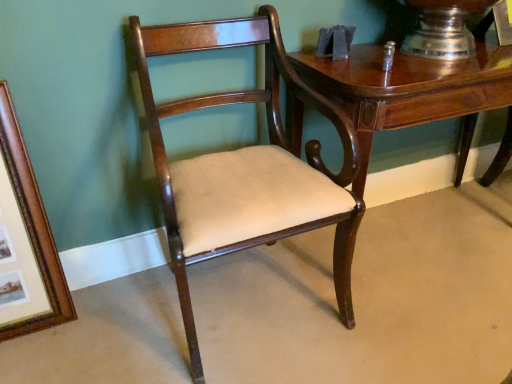
Question: From the image's perspective, is wooden picture frame at left located above mahogany wood chair at center?

Choices:
 (A) yes
 (B) no

Answer: (B)

Question: Can you confirm if wooden picture frame at left is bigger than mahogany wood chair at center?

Choices:
 (A) no
 (B) yes

Answer: (A)

Question: Does wooden picture frame at left lie behind mahogany wood chair at center?

Choices:
 (A) yes
 (B) no

Answer: (A)

Question: From the image's perspective, is wooden picture frame at left below mahogany wood chair at center?

Choices:
 (A) yes
 (B) no

Answer: (A)

Question: Can you confirm if wooden picture frame at left is wider than mahogany wood chair at center?

Choices:
 (A) no
 (B) yes

Answer: (A)

Question: Visually, is mahogany wood chair at center positioned to the left or to the right of glossy wood table at upper right?

Choices:
 (A) left
 (B) right

Answer: (A)

Question: Is mahogany wood chair at center inside or outside of glossy wood table at upper right?

Choices:
 (A) outside
 (B) inside

Answer: (A)

Question: In terms of width, does mahogany wood chair at center look wider or thinner when compared to glossy wood table at upper right?

Choices:
 (A) wide
 (B) thin

Answer: (A)

Question: Is point (202, 182) closer or farther from the camera than point (417, 102)?

Choices:
 (A) farther
 (B) closer

Answer: (B)

Question: From the image's perspective, is wooden picture frame at left positioned above or below mahogany wood chair at center?

Choices:
 (A) above
 (B) below

Answer: (B)

Question: In terms of height, does wooden picture frame at left look taller or shorter compared to mahogany wood chair at center?

Choices:
 (A) tall
 (B) short

Answer: (B)

Question: Is point (44, 263) positioned closer to the camera than point (234, 39)?

Choices:
 (A) farther
 (B) closer

Answer: (A)

Question: In terms of width, does wooden picture frame at left look wider or thinner when compared to mahogany wood chair at center?

Choices:
 (A) wide
 (B) thin

Answer: (B)

Question: Based on their sizes in the image, would you say glossy wood table at upper right is bigger or smaller than wooden picture frame at left?

Choices:
 (A) big
 (B) small

Answer: (A)

Question: Is point (330, 94) positioned closer to the camera than point (33, 304)?

Choices:
 (A) closer
 (B) farther

Answer: (A)